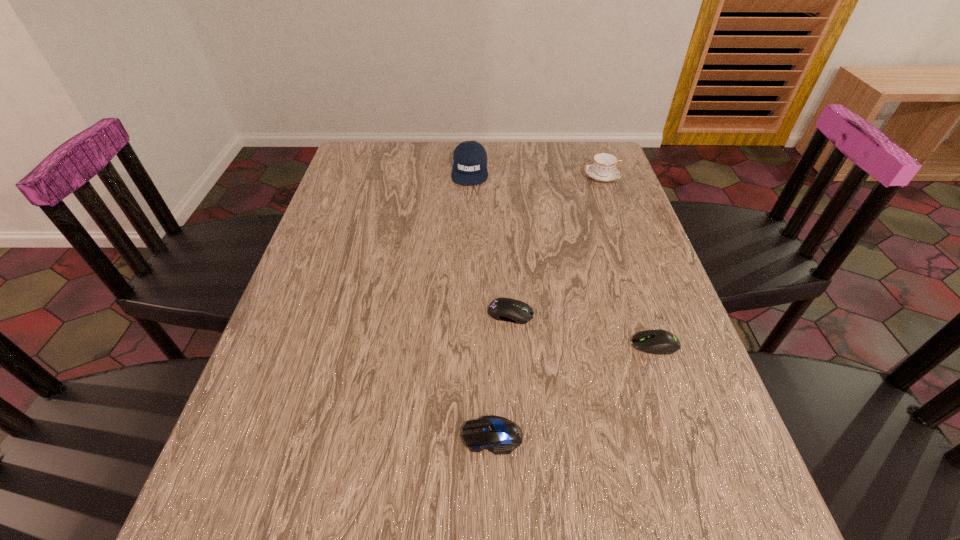
Locate an element on the screen. The width and height of the screenshot is (960, 540). baseball cap is located at coordinates (469, 158).

You are a GUI agent. You are given a task and a screenshot of the screen. Output one action in this format:
    pyautogui.click(x=<x>, y=<y>)
    Task: Click on the teacup
    
    Given the screenshot: What is the action you would take?
    pyautogui.click(x=603, y=167)

Where is `the third nearest object`? the third nearest object is located at coordinates [x=504, y=309].

This screenshot has width=960, height=540. In order to click on the second farthest computer mouse in this screenshot , I will do `click(661, 342)`.

This screenshot has height=540, width=960. I want to click on the fourth farthest object, so click(661, 342).

Identify the location of the nearest object. (499, 435).

I want to click on free space located 0.080m on the front-facing side of the baseball cap, so [x=468, y=203].

Where is `vacant space located 0.340m on the back of the third nearest object`? vacant space located 0.340m on the back of the third nearest object is located at coordinates (504, 211).

Locate an element on the screen. This screenshot has height=540, width=960. blank area located 0.220m on the wheel side of the second nearest computer mouse is located at coordinates click(524, 345).

Identify the location of vacant space located 0.340m on the wheel side of the second nearest computer mouse. Image resolution: width=960 pixels, height=540 pixels. [466, 345].